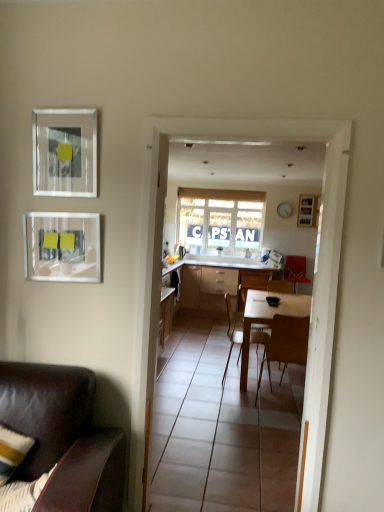
Question: Is wooden chair at center, which is the 4th chair from front to back, to the right of matte glass picture frame at upper left, acting as the 2th picture frame starting from the front, from the viewer's perspective?

Choices:
 (A) no
 (B) yes

Answer: (B)

Question: Is wooden chair at center, the 2th chair from the back, at the left side of matte glass picture frame at upper left, acting as the 3th picture frame starting from the top?

Choices:
 (A) no
 (B) yes

Answer: (A)

Question: From the image's perspective, would you say wooden chair at center, acting as the third chair starting from the left, is shown under matte glass picture frame at upper left, acting as the third picture frame starting from the right?

Choices:
 (A) no
 (B) yes

Answer: (B)

Question: From the image's perspective, is wooden chair at center, the 2th chair from the back, located above matte glass picture frame at upper left, which ranks as the first picture frame in bottom-to-top order?

Choices:
 (A) yes
 (B) no

Answer: (B)

Question: Is wooden chair at center, acting as the third chair starting from the left, bigger than matte glass picture frame at upper left, which is counted as the second picture frame, starting from the back?

Choices:
 (A) no
 (B) yes

Answer: (B)

Question: Is wooden chair at center, acting as the third chair starting from the right, wider than matte glass picture frame at upper left, acting as the 3th picture frame starting from the top?

Choices:
 (A) yes
 (B) no

Answer: (A)

Question: Is white glossy table at center at the back of wooden chair at center, which is the third chair from back to front?

Choices:
 (A) no
 (B) yes

Answer: (A)

Question: Is wooden chair at center, positioned as the 2th chair in left-to-right order, closer to camera compared to white glossy table at center?

Choices:
 (A) yes
 (B) no

Answer: (A)

Question: Can you confirm if wooden chair at center, marked as the third chair in a front-to-back arrangement, is positioned to the left of white glossy table at center?

Choices:
 (A) yes
 (B) no

Answer: (A)

Question: Could you tell me if wooden chair at center, which is the third chair from back to front, is turned towards white glossy table at center?

Choices:
 (A) yes
 (B) no

Answer: (B)

Question: Is wooden chair at center, positioned as the 2th chair in left-to-right order, far from white glossy table at center?

Choices:
 (A) yes
 (B) no

Answer: (B)

Question: Is wooden chair at center, which is the fourth chair from right to left, taller than white glossy table at center?

Choices:
 (A) yes
 (B) no

Answer: (B)

Question: From the image's perspective, is white glossy table at center on matte glass picture frame at upper left, acting as the 2th picture frame starting from the front?

Choices:
 (A) yes
 (B) no

Answer: (B)